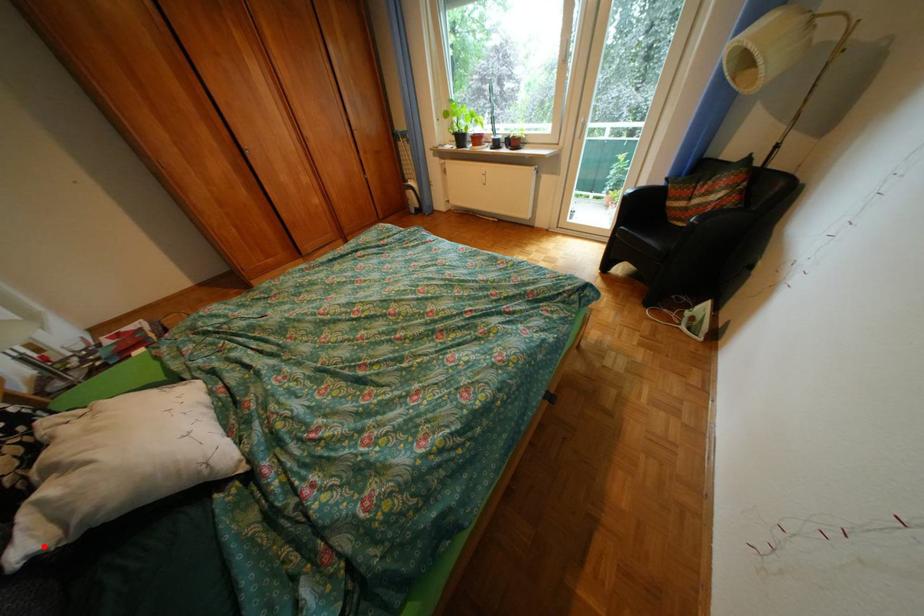
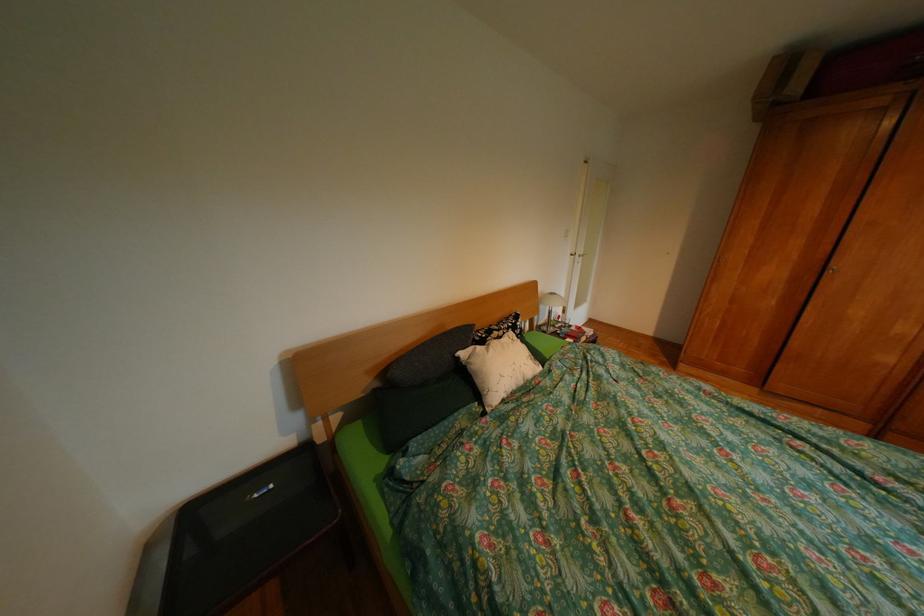
Where in the second image is the point corresponding to the highlighted location from the first image?

(477, 354)